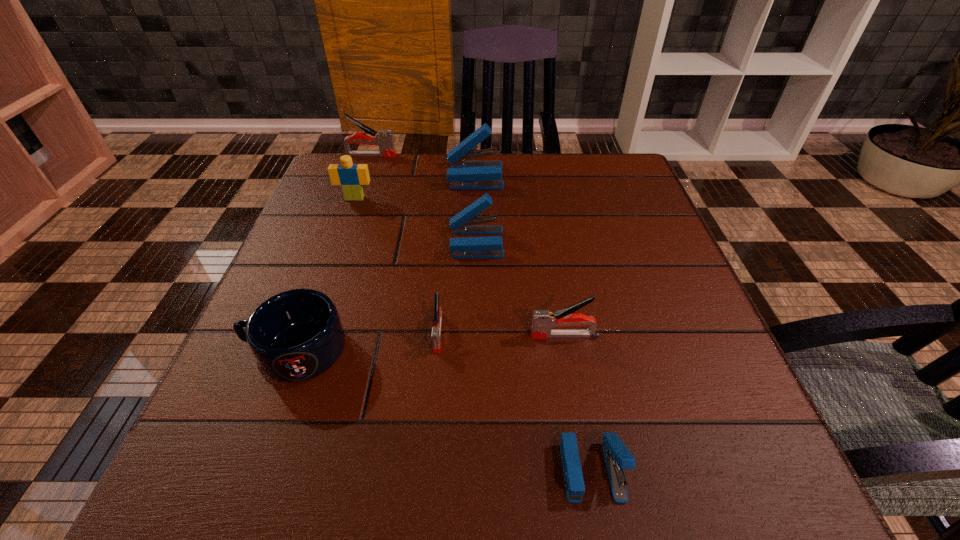
Where is `vacant area between the second farthest blue stapler and the beige Lego`? The image size is (960, 540). vacant area between the second farthest blue stapler and the beige Lego is located at coordinates (416, 220).

In order to click on vacant region between the third farthest object and the rightmost blue stapler in this screenshot , I will do `click(473, 334)`.

Find the location of a particular element. This screenshot has width=960, height=540. vacant space that is in between the smallest gray stapler and the nearest stapler is located at coordinates (516, 401).

Locate an element on the screen. object identified as the second closest to the farthest gray stapler is located at coordinates 351,177.

Where is `object that can be found as the second closest to the biggest blue stapler`? object that can be found as the second closest to the biggest blue stapler is located at coordinates (464, 222).

Locate which stapler is the second closest to the smallest gray stapler. Please provide its 2D coordinates. Your answer should be formatted as a tuple, i.e. [(x, y)], where the tuple contains the x and y coordinates of a point satisfying the conditions above.

[(543, 321)]

Locate an element on the screen. The height and width of the screenshot is (540, 960). stapler identified as the fourth closest to the fifth nearest stapler is located at coordinates (543, 321).

Find the location of a particular element. The width and height of the screenshot is (960, 540). gray stapler object that ranks as the third closest to the beige Lego is located at coordinates (543, 321).

Locate which gray stapler is the second closest to the blue mug. Please provide its 2D coordinates. Your answer should be formatted as a tuple, i.e. [(x, y)], where the tuple contains the x and y coordinates of a point satisfying the conditions above.

[(543, 321)]

Locate an element on the screen. blue stapler that stands as the second closest to the biggest gray stapler is located at coordinates (464, 222).